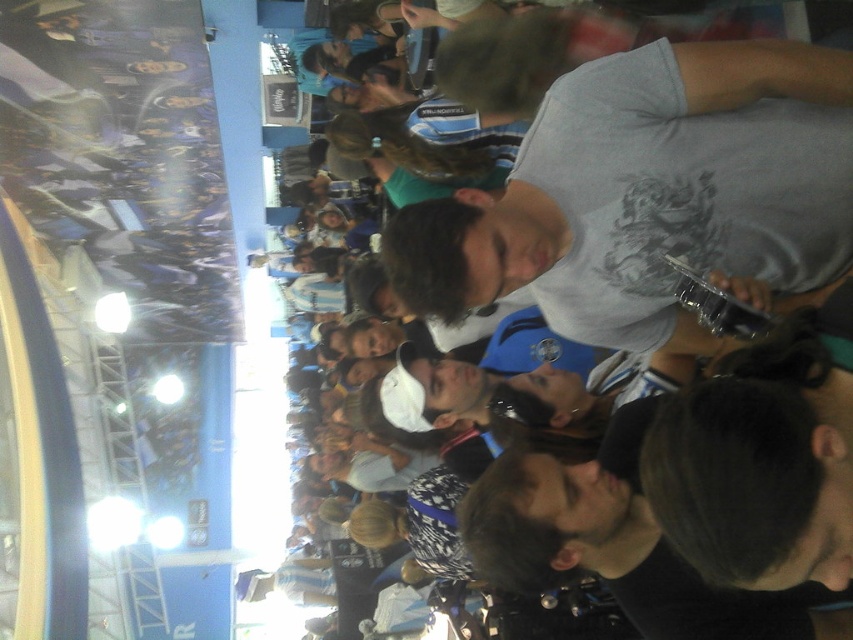
Question: Does gray matte t-shirt at center have a larger size compared to black matte shirt at center?

Choices:
 (A) yes
 (B) no

Answer: (A)

Question: Does gray matte t-shirt at center appear under white cotton shirt at center?

Choices:
 (A) yes
 (B) no

Answer: (B)

Question: Is gray matte t-shirt at center to the right of black matte shirt at center from the viewer's perspective?

Choices:
 (A) yes
 (B) no

Answer: (A)

Question: Among these objects, which one is nearest to the camera?

Choices:
 (A) white cotton shirt at center
 (B) black matte shirt at center
 (C) gray matte t-shirt at center

Answer: (B)

Question: Which object is the closest to the black matte shirt at center?

Choices:
 (A) gray matte t-shirt at center
 (B) white cotton shirt at center

Answer: (B)

Question: Which of these objects is positioned farthest from the gray matte t-shirt at center?

Choices:
 (A) white cotton shirt at center
 (B) black matte shirt at center

Answer: (B)